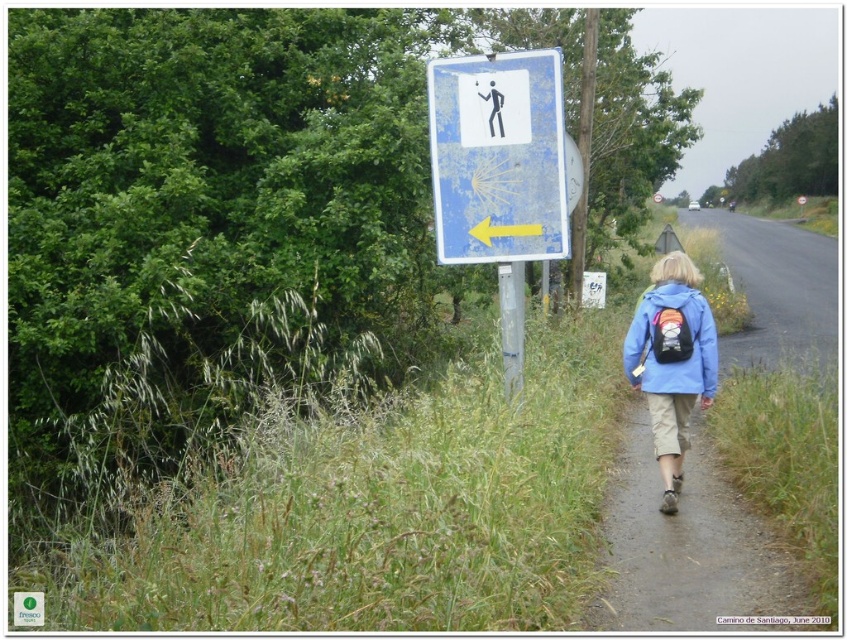
You are standing at the starting point of the path and see the blue faded sign at upper center. According to the coordinates provided, is the sign positioned closer to the top or bottom of the image?

The blue faded sign at upper center is located at point 0.247 on the vertical axis, which is closer to the top of the image since lower numbers on the vertical axis typically represent positions closer to the top in coordinate systems.

You are a hiker trying to follow the path. You see the blue faded sign at upper center and the blue matte jacket at lower right. Which object is taller?

The blue faded sign at upper center is much taller than the blue matte jacket at lower right.